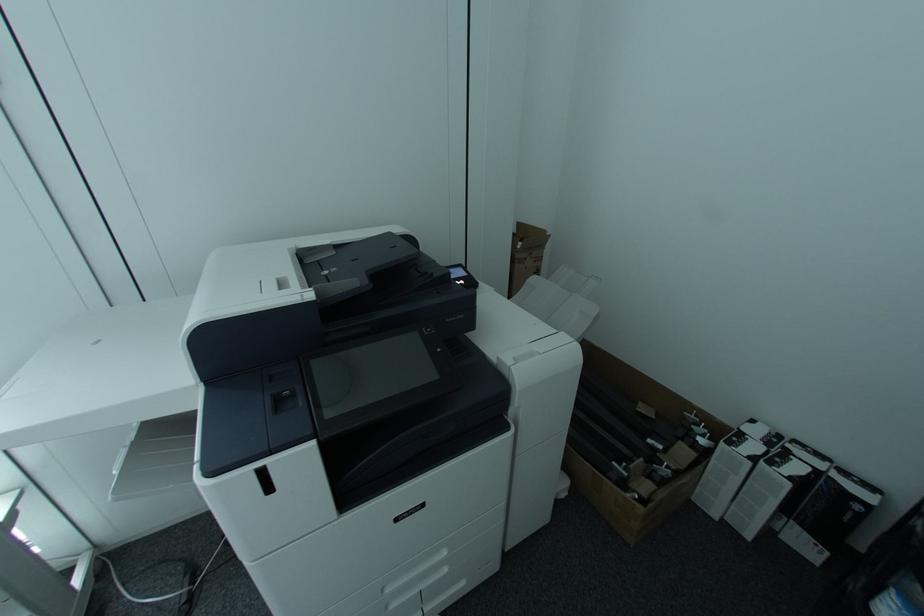
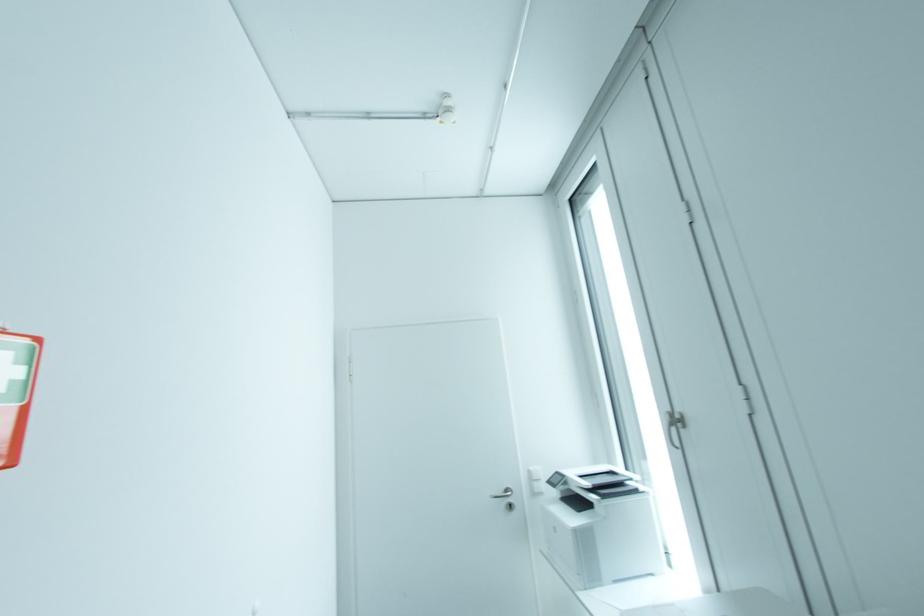
Question: Based on the continuous images, in which direction is the camera rotating? Reply with the corresponding letter.

Choices:
 (A) Left
 (B) Right
 (C) Up
 (D) Down

Answer: (A)